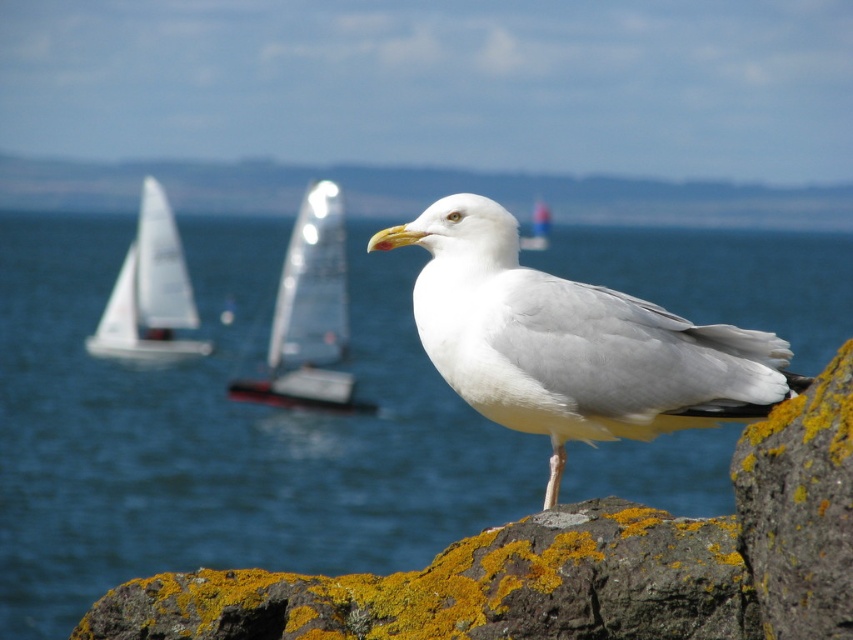
Between blue water at center and white glossy sailboat at center, which one is positioned lower?

blue water at center is lower down.

Between blue water at center and white glossy sailboat at center, which one appears on the right side from the viewer's perspective?

Positioned to the right is white glossy sailboat at center.

This screenshot has width=853, height=640. What do you see at coordinates (221, 429) in the screenshot?
I see `blue water at center` at bounding box center [221, 429].

You are a GUI agent. You are given a task and a screenshot of the screen. Output one action in this format:
    pyautogui.click(x=<x>, y=<y>)
    Task: Click on the blue water at center
    
    Given the screenshot: What is the action you would take?
    pyautogui.click(x=221, y=429)

Is blue water at center taller than translucent white sailboat at center?

Indeed, blue water at center has a greater height compared to translucent white sailboat at center.

Who is lower down, blue water at center or translucent white sailboat at center?

blue water at center is below.

Which is in front, point (30, 483) or point (306, 378)?

Positioned in front is point (30, 483).

Where is `blue water at center`? Image resolution: width=853 pixels, height=640 pixels. blue water at center is located at coordinates tap(221, 429).

Can you confirm if white feathered bird at center is bigger than white sailboat at left?

No, white feathered bird at center is not bigger than white sailboat at left.

Is white feathered bird at center thinner than white sailboat at left?

Yes.

Find the location of a particular element. The image size is (853, 640). white feathered bird at center is located at coordinates (572, 342).